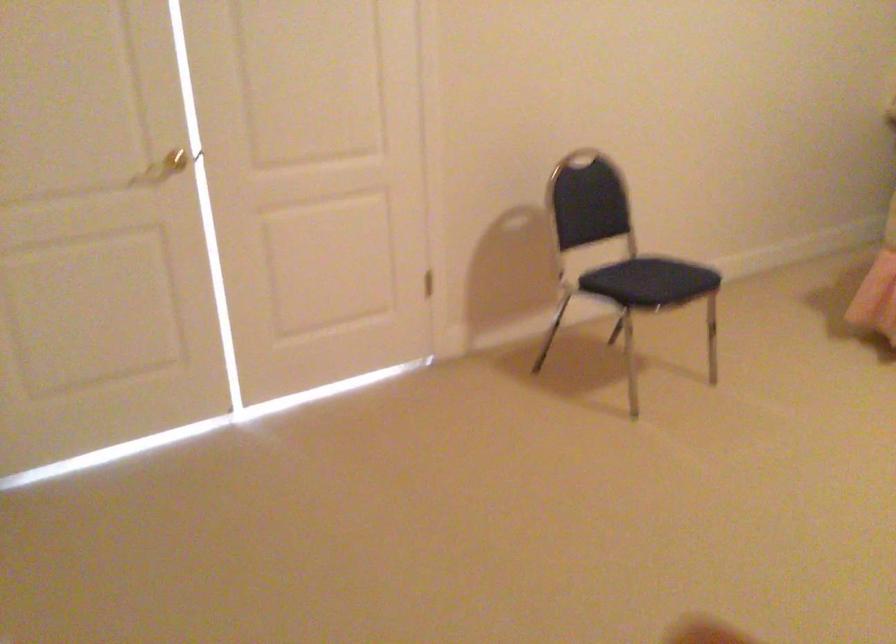
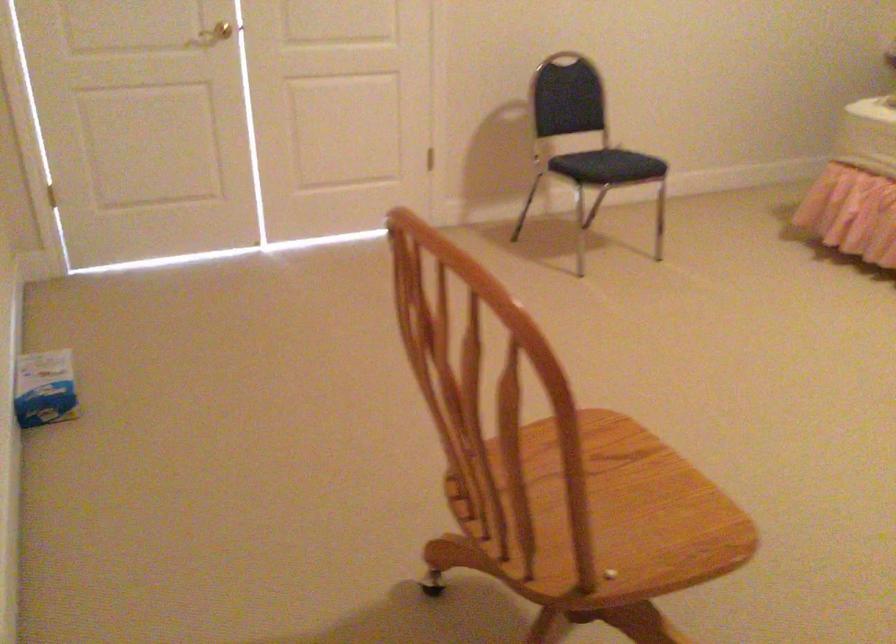
Find the pixel in the second image that matches [640,287] in the first image.

(607, 166)